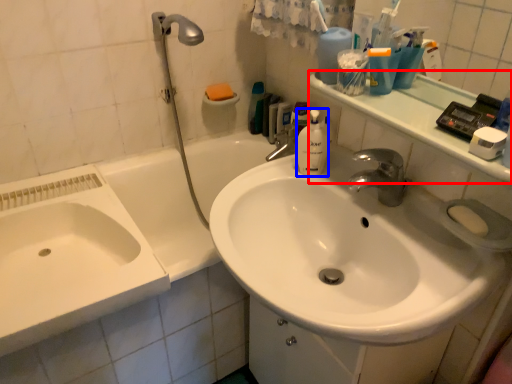
Question: Among these objects, which one is nearest to the camera, counter top (highlighted by a red box) or cleaning product (highlighted by a blue box)?

Choices:
 (A) counter top
 (B) cleaning product

Answer: (A)